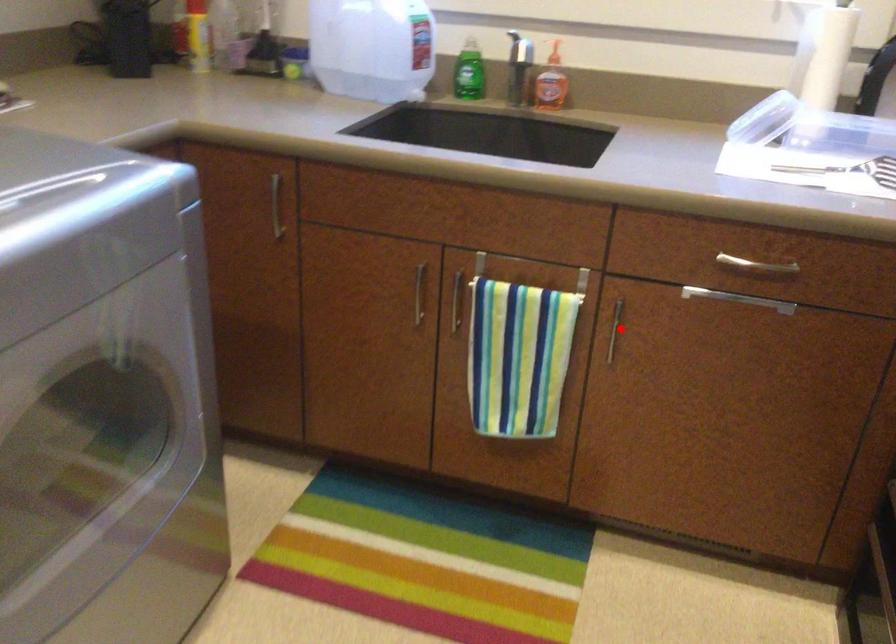
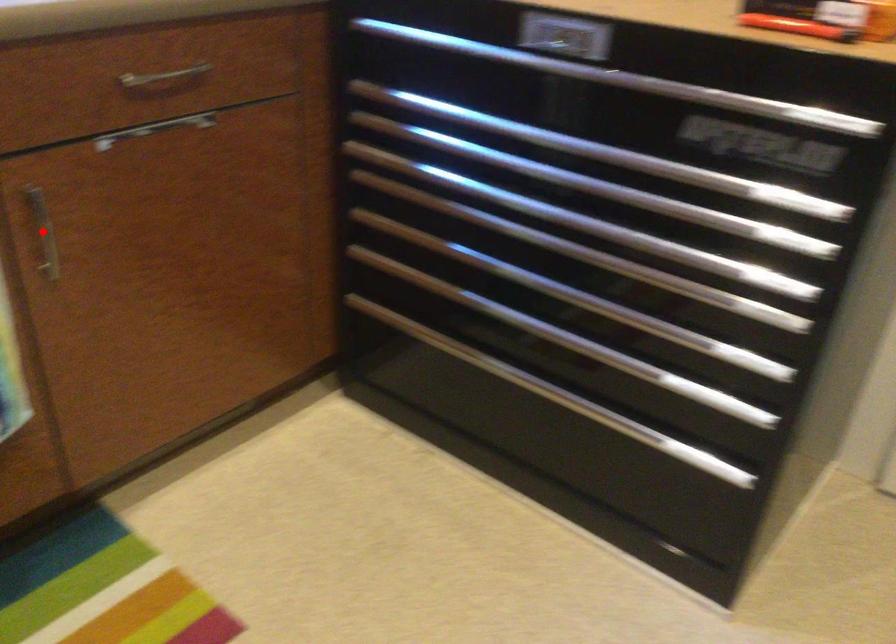
I am providing you with two images of the same scene from different viewpoints. A red point is marked on the first image and another point is marked on the second image. Do the highlighted points in image1 and image2 indicate the same real-world spot?

Yes